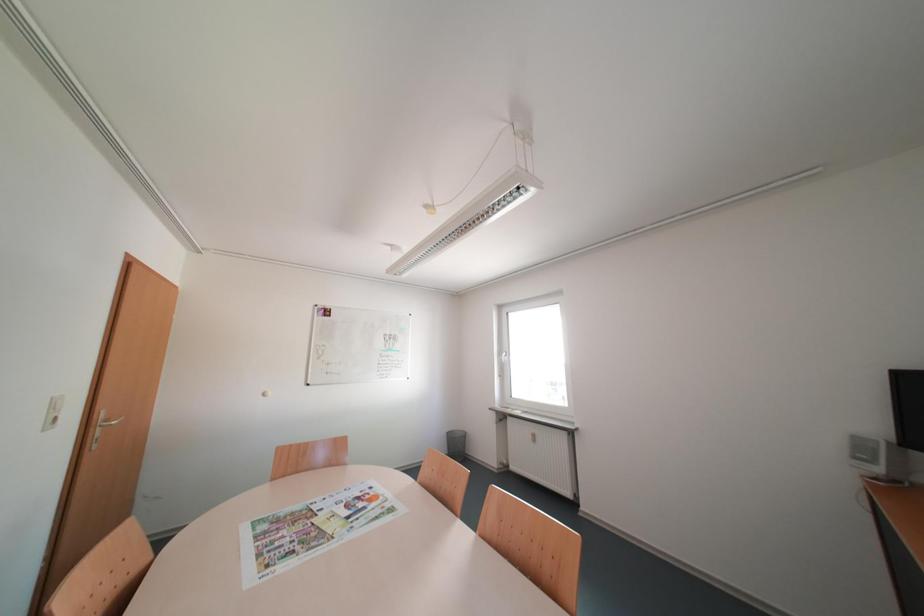
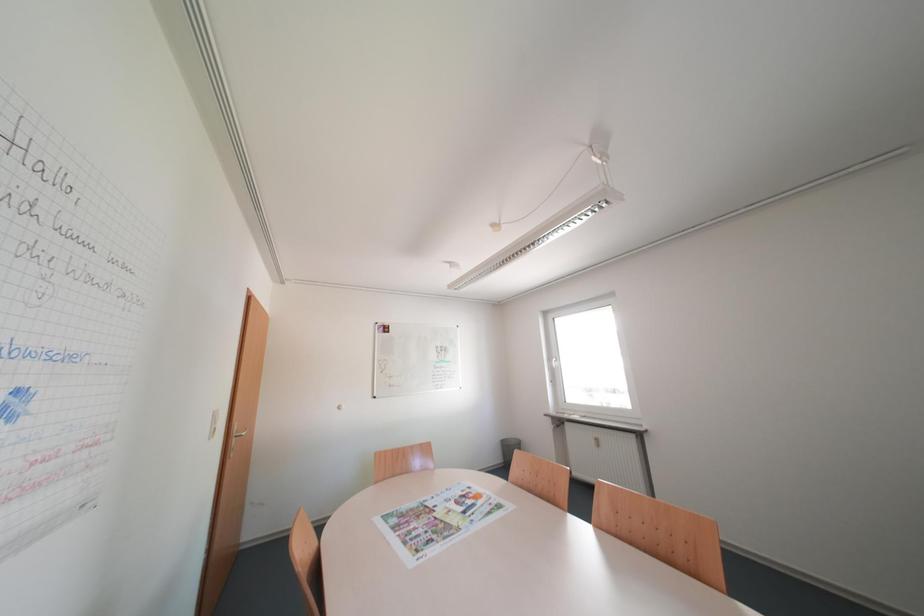
In a continuous first-person perspective shot, in which direction is the camera moving?

The cameraman moved toward left, backward.